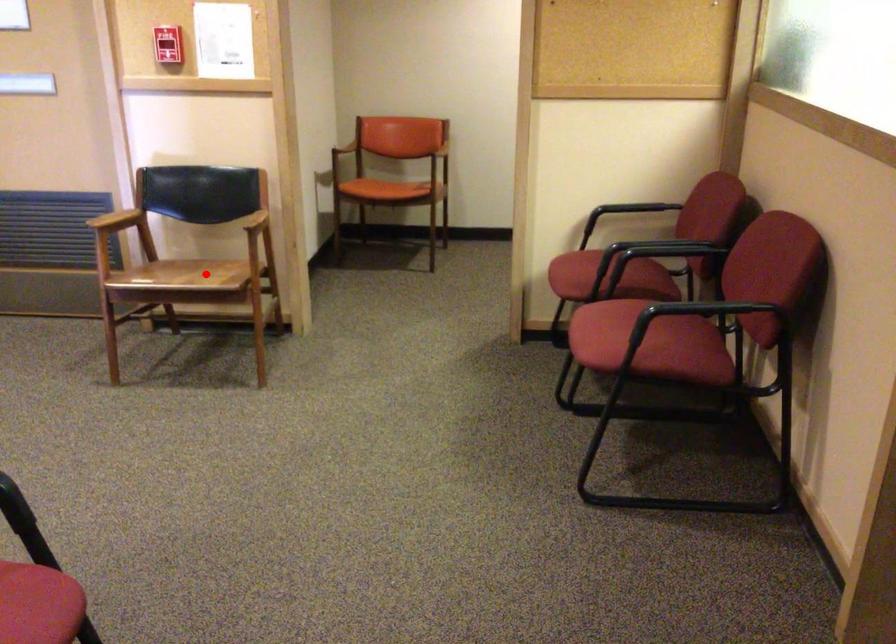
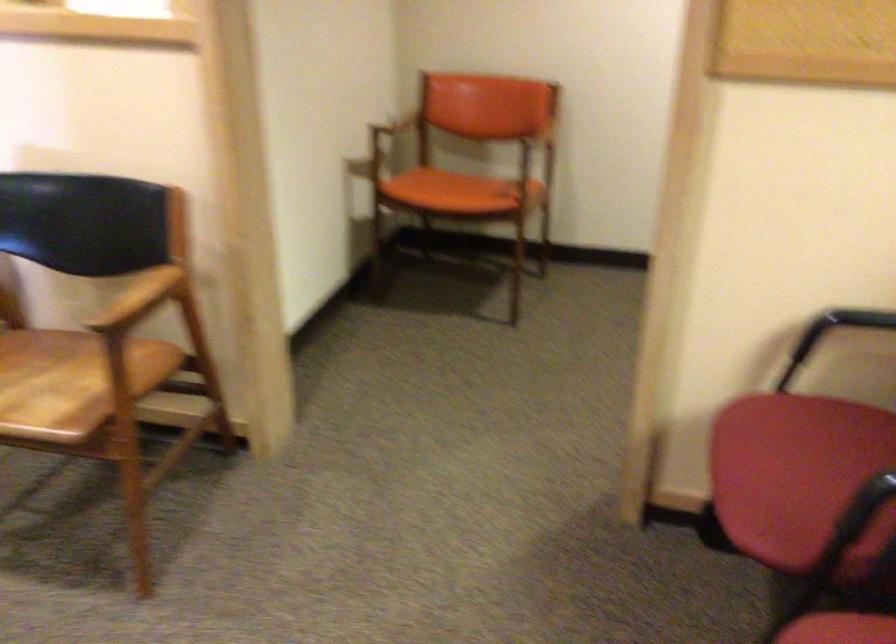
In the second image, find the point that corresponds to the highlighted location in the first image.

(71, 381)